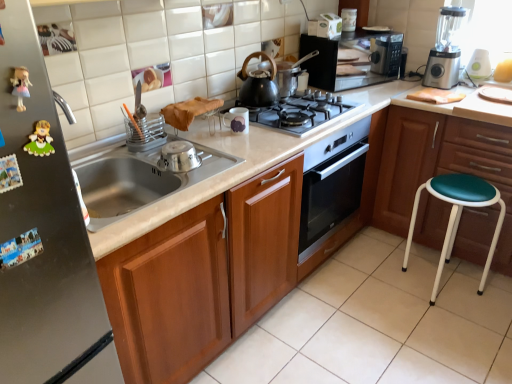
Image resolution: width=512 pixels, height=384 pixels. Find the location of `vacant point above green leather stool at right (from a real-world perspective)`. vacant point above green leather stool at right (from a real-world perspective) is located at coordinates (468, 98).